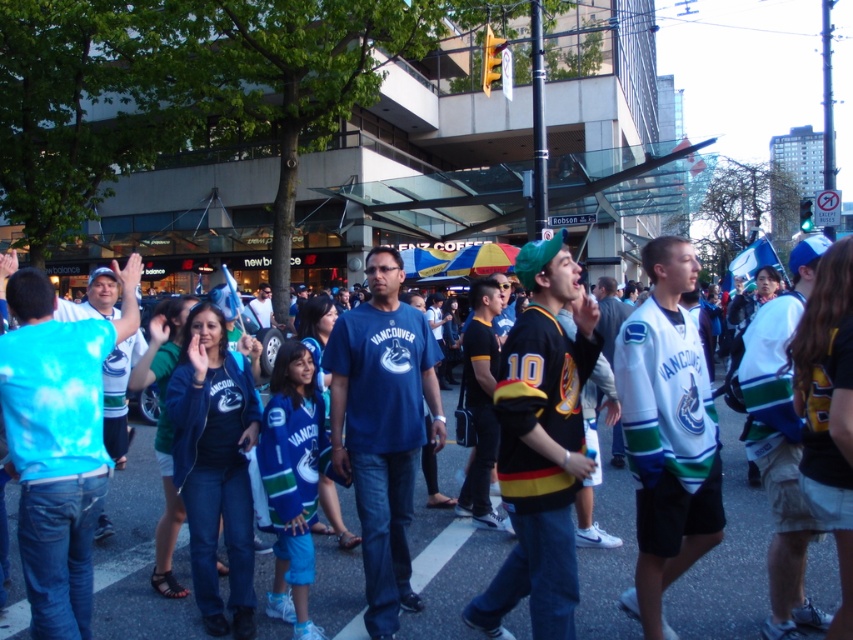
Question: Which object appears farthest from the camera in this image?

Choices:
 (A) blue cotton t-shirt at center
 (B) blue jersey at center

Answer: (B)

Question: Is blue jersey at center in front of blue cotton t-shirt at center?

Choices:
 (A) yes
 (B) no

Answer: (B)

Question: Which point appears farthest from the camera in this image?

Choices:
 (A) [x=360, y=413]
 (B) [x=316, y=554]

Answer: (B)

Question: Does blue jersey at center lie in front of blue cotton t-shirt at center?

Choices:
 (A) yes
 (B) no

Answer: (B)

Question: Among these objects, which one is nearest to the camera?

Choices:
 (A) blue cotton t-shirt at center
 (B) blue jersey at center

Answer: (A)

Question: Can you confirm if blue jersey at center is positioned above blue cotton t-shirt at center?

Choices:
 (A) yes
 (B) no

Answer: (B)